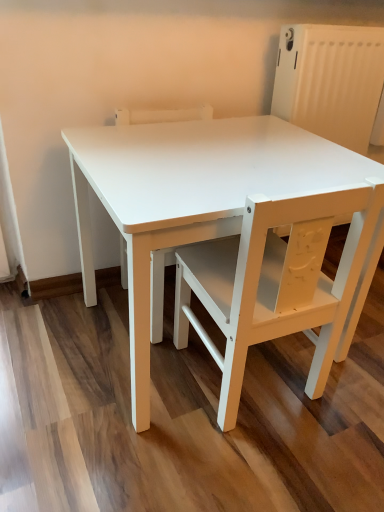
Question: In which direction should I rotate to look at white matte chair at center, which is counted as the 2th chair, starting from the right?

Choices:
 (A) left
 (B) right

Answer: (A)

Question: From the image's perspective, would you say white matte chair at center, the 2th chair positioned from the left, is shown under white matte chair at center, which is counted as the 2th chair, starting from the right?

Choices:
 (A) no
 (B) yes

Answer: (B)

Question: Is white matte chair at center, the 2th chair positioned from the left, positioned with its back to white matte chair at center, which is counted as the 2th chair, starting from the right?

Choices:
 (A) no
 (B) yes

Answer: (A)

Question: Is white matte chair at center, positioned as the first chair in right-to-left order, positioned behind white matte chair at center, which is counted as the 2th chair, starting from the right?

Choices:
 (A) yes
 (B) no

Answer: (B)

Question: Is white matte chair at center, which is counted as the 2th chair, starting from the right, located within white matte chair at center, positioned as the first chair in right-to-left order?

Choices:
 (A) yes
 (B) no

Answer: (B)

Question: From a real-world perspective, is white matte chair at center, positioned as the first chair in right-to-left order, positioned under white matte chair at center, arranged as the 1th chair when viewed from the left, based on gravity?

Choices:
 (A) no
 (B) yes

Answer: (A)

Question: Considering the relative sizes of white matte chair at center, positioned as the first chair in right-to-left order, and white matte chair at center, arranged as the 1th chair when viewed from the left, in the image provided, is white matte chair at center, positioned as the first chair in right-to-left order, taller than white matte chair at center, arranged as the 1th chair when viewed from the left,?

Choices:
 (A) yes
 (B) no

Answer: (B)

Question: Is white matte chair at center, arranged as the 1th chair when viewed from the left, taller than white matte chair at center, positioned as the first chair in right-to-left order?

Choices:
 (A) no
 (B) yes

Answer: (B)

Question: From the image's perspective, is white matte chair at center, arranged as the 1th chair when viewed from the left, under white matte chair at center, positioned as the first chair in right-to-left order?

Choices:
 (A) yes
 (B) no

Answer: (B)

Question: From a real-world perspective, is white matte chair at center, arranged as the 1th chair when viewed from the left, physically below white matte chair at center, the 2th chair positioned from the left?

Choices:
 (A) yes
 (B) no

Answer: (A)

Question: Is white matte chair at center, positioned as the first chair in right-to-left order, at the back of white matte chair at center, arranged as the 1th chair when viewed from the left?

Choices:
 (A) yes
 (B) no

Answer: (B)

Question: From the image's perspective, is white matte chair at center, arranged as the 1th chair when viewed from the left, located above white matte chair at center, positioned as the first chair in right-to-left order?

Choices:
 (A) no
 (B) yes

Answer: (B)

Question: From a real-world perspective, does white matte chair at center, arranged as the 1th chair when viewed from the left, stand above white matte chair at center, the 2th chair positioned from the left?

Choices:
 (A) yes
 (B) no

Answer: (B)

Question: Would you say white matte chair at center, arranged as the 1th chair when viewed from the left, is inside or outside white matte chair at center, positioned as the first chair in right-to-left order?

Choices:
 (A) inside
 (B) outside

Answer: (B)